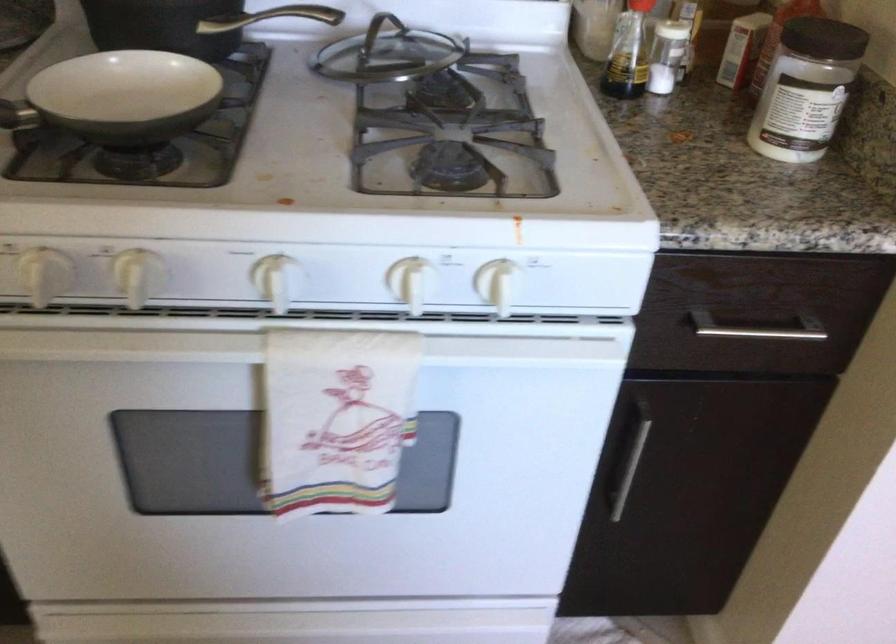
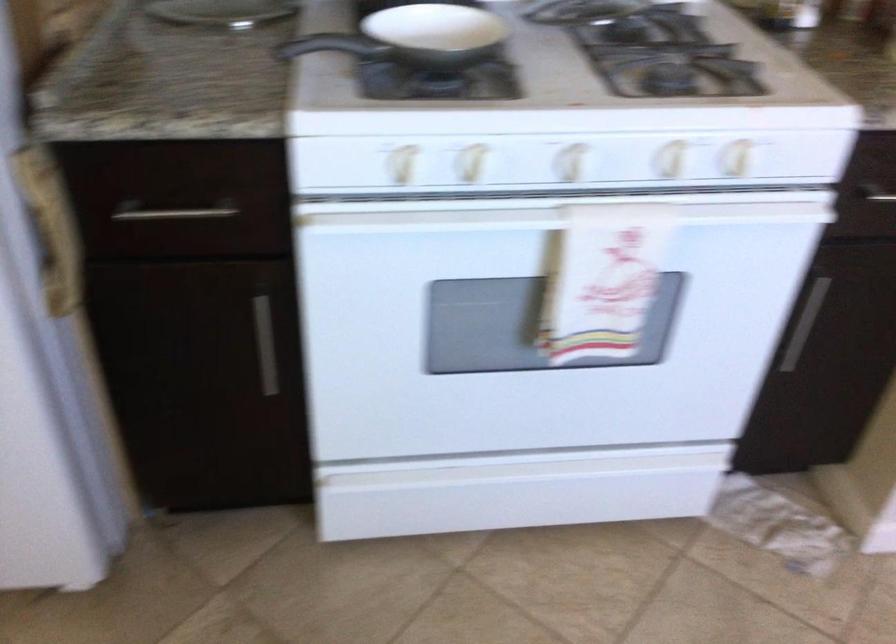
Locate, in the second image, the point that corresponds to point (280, 283) in the first image.

(573, 162)